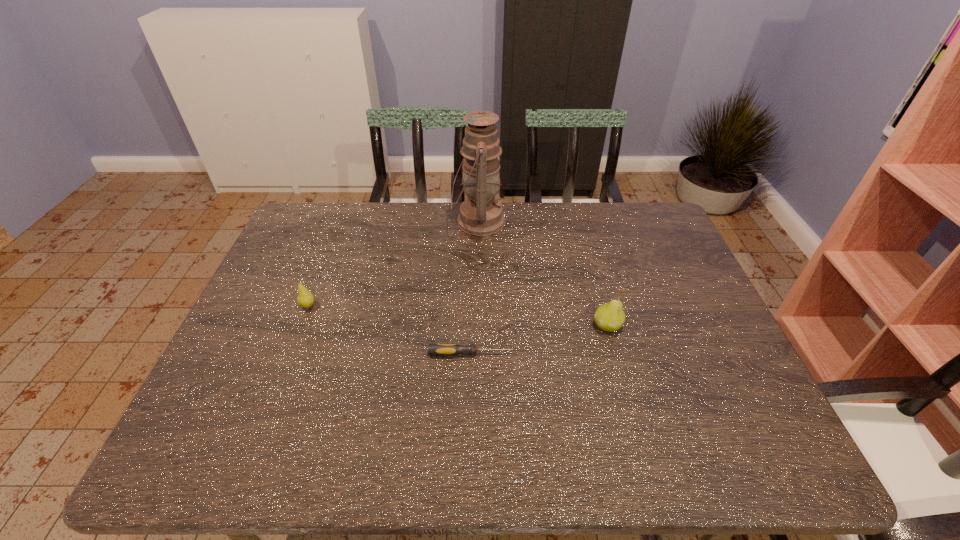
You are a GUI agent. You are given a task and a screenshot of the screen. Output one action in this format:
    pyautogui.click(x=<x>, y=<y>)
    Task: Click on the oil lamp
    
    Given the screenshot: What is the action you would take?
    pos(481,214)

The height and width of the screenshot is (540, 960). Find the location of `the farthest object`. the farthest object is located at coordinates (481, 214).

The height and width of the screenshot is (540, 960). I want to click on the right pear, so click(x=610, y=317).

Find the location of a particular element. This screenshot has width=960, height=540. the third shortest object is located at coordinates (610, 317).

You are a GUI agent. You are given a task and a screenshot of the screen. Output one action in this format:
    pyautogui.click(x=<x>, y=<y>)
    Task: Click on the third nearest object
    This screenshot has width=960, height=540.
    Given the screenshot: What is the action you would take?
    pyautogui.click(x=305, y=299)

Find the location of `the second shortest object`. the second shortest object is located at coordinates (305, 299).

At what (x,y) coordinates should I click in order to perform the action: click on the shortest object. Please return your answer as a coordinate pair (x, y). Looking at the image, I should click on point(433,349).

This screenshot has height=540, width=960. Find the location of `screwdriver`. screwdriver is located at coordinates (433, 349).

You are a GUI agent. You are given a task and a screenshot of the screen. Output one action in this format:
    pyautogui.click(x=<x>, y=<y>)
    Task: Click on the vacant space located on the front of the farthest object
    This screenshot has width=960, height=540.
    Given the screenshot: What is the action you would take?
    pyautogui.click(x=478, y=281)

Locate an element on the screen. The image size is (960, 540). vacant region located 0.180m on the left of the second nearest object is located at coordinates (523, 326).